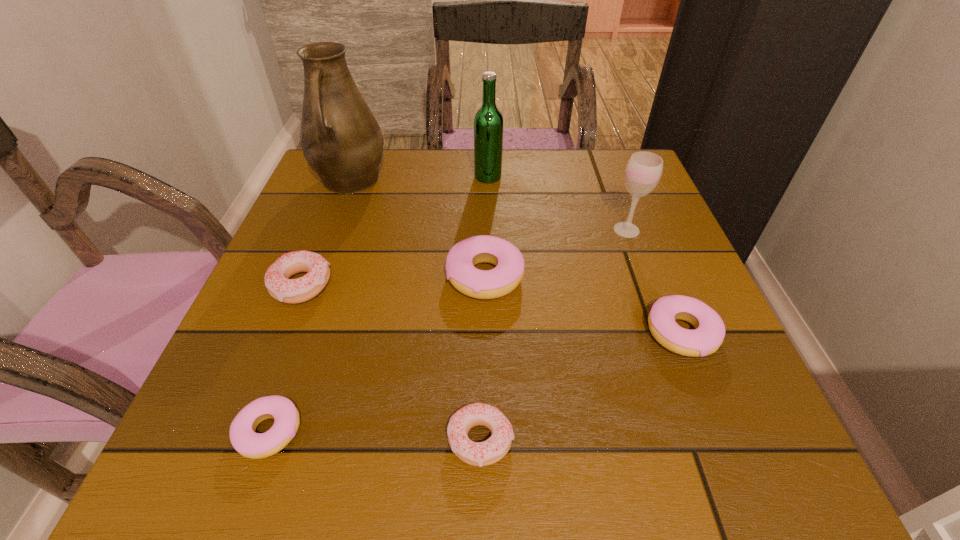
Identify the location of vacant region located 0.290m on the left of the second smallest pink doughnut. The image size is (960, 540). (475, 333).

Find the location of `blank space located on the back of the right white doughnut`. blank space located on the back of the right white doughnut is located at coordinates (481, 284).

Identify the location of free space located 0.120m on the back of the leftmost pink doughnut. This screenshot has height=540, width=960. (302, 338).

You are a GUI agent. You are given a task and a screenshot of the screen. Output one action in this format:
    pyautogui.click(x=<x>, y=<y>)
    Task: Click on the pitcher present at the far edge
    The width and height of the screenshot is (960, 540).
    Given the screenshot: What is the action you would take?
    pyautogui.click(x=341, y=140)

Identify the location of beer bottle present at the far edge. (488, 123).

Find the location of a particular element. The height and width of the screenshot is (540, 960). pitcher present at the left edge is located at coordinates (341, 140).

Where is `wineglass located in the right edge section of the desktop`? The image size is (960, 540). wineglass located in the right edge section of the desktop is located at coordinates (643, 171).

This screenshot has height=540, width=960. I want to click on doughnut situated at the right edge, so click(x=708, y=335).

Find the location of `object present at the far left corner`. object present at the far left corner is located at coordinates (341, 140).

The width and height of the screenshot is (960, 540). I want to click on object that is at the near left corner, so click(245, 440).